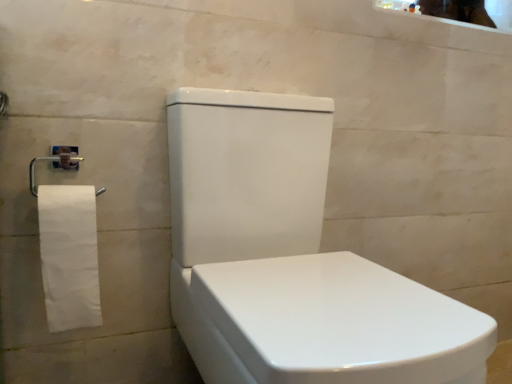
What do you see at coordinates (69, 256) in the screenshot?
I see `white matte toilet paper at left` at bounding box center [69, 256].

Identify the location of glossy ceramic mirror at upper right. (457, 10).

Image resolution: width=512 pixels, height=384 pixels. In order to click on white glossy toilet at center in this screenshot , I will do `click(291, 259)`.

The height and width of the screenshot is (384, 512). I want to click on white matte toilet paper at left, so click(x=69, y=256).

Can you confirm if glossy ceramic mirror at upper right is taller than white glossy toilet at center?

In fact, glossy ceramic mirror at upper right may be shorter than white glossy toilet at center.

Are glossy ceramic mirror at upper right and white glossy toilet at center making contact?

They are not placed beside each other.

From a real-world perspective, which object stands above the other?

From a 3D spatial view, glossy ceramic mirror at upper right is above.

Which is behind, white glossy toilet at center or white matte toilet paper at left?

white matte toilet paper at left.

Who is shorter, white glossy toilet at center or white matte toilet paper at left?

white matte toilet paper at left.

Considering the sizes of white glossy toilet at center and white matte toilet paper at left in the image, is white glossy toilet at center wider or thinner than white matte toilet paper at left?

In the image, white glossy toilet at center appears to be wider than white matte toilet paper at left.

Image resolution: width=512 pixels, height=384 pixels. Find the location of `toilet located below the white matte toilet paper at left (from the image's perspective)`. toilet located below the white matte toilet paper at left (from the image's perspective) is located at coordinates (291, 259).

Does white glossy toilet at center touch glossy ceramic mirror at upper right?

There is a gap between white glossy toilet at center and glossy ceramic mirror at upper right.

From a real-world perspective, is white glossy toilet at center on glossy ceramic mirror at upper right?

No, from a real-world perspective, white glossy toilet at center is not above glossy ceramic mirror at upper right.

Can glossy ceramic mirror at upper right be found inside white glossy toilet at center?

Actually, glossy ceramic mirror at upper right is outside white glossy toilet at center.

Which object is further away from the camera taking this photo, white glossy toilet at center or glossy ceramic mirror at upper right?

glossy ceramic mirror at upper right is more distant.

Does point (50, 306) come closer to viewer compared to point (453, 7)?

Yes, point (50, 306) is closer to viewer.

Consider the image. Which of these two, white matte toilet paper at left or glossy ceramic mirror at upper right, is wider?

With larger width is glossy ceramic mirror at upper right.

I want to click on mirror above the white matte toilet paper at left (from a real-world perspective), so click(457, 10).

Between glossy ceramic mirror at upper right and white matte toilet paper at left, which one appears on the left side from the viewer's perspective?

Positioned to the left is white matte toilet paper at left.

From the image's perspective, which is above, glossy ceramic mirror at upper right or white matte toilet paper at left?

glossy ceramic mirror at upper right.

Considering their positions, is glossy ceramic mirror at upper right located in front of or behind white matte toilet paper at left?

Visually, glossy ceramic mirror at upper right is located behind white matte toilet paper at left.

From their relative heights in the image, would you say white matte toilet paper at left is taller or shorter than white glossy toilet at center?

In the image, white matte toilet paper at left appears to be shorter than white glossy toilet at center.

How many degrees apart are the facing directions of white matte toilet paper at left and white glossy toilet at center?

The angular difference between white matte toilet paper at left and white glossy toilet at center is 0.772 degrees.

In the image, is white matte toilet paper at left positioned in front of or behind white glossy toilet at center?

Clearly, white matte toilet paper at left is behind white glossy toilet at center.

You are a GUI agent. You are given a task and a screenshot of the screen. Output one action in this format:
    pyautogui.click(x=<x>, y=<y>)
    Task: Click on the toilet below the white matte toilet paper at left (from the image's perspective)
    The image size is (512, 384).
    Given the screenshot: What is the action you would take?
    pyautogui.click(x=291, y=259)

Image resolution: width=512 pixels, height=384 pixels. Identify the location of mirror positioned vertically above the white glossy toilet at center (from a real-world perspective). (457, 10).

Where is `toilet located below the white matte toilet paper at left (from the image's perspective)`? toilet located below the white matte toilet paper at left (from the image's perspective) is located at coordinates (291, 259).

Estimate the real-world distances between objects in this image. Which object is further from white matte toilet paper at left, glossy ceramic mirror at upper right or white glossy toilet at center?

Based on the image, glossy ceramic mirror at upper right appears to be further to white matte toilet paper at left.

Which object lies further to the anchor point glossy ceramic mirror at upper right, white matte toilet paper at left or white glossy toilet at center?

white matte toilet paper at left is further to glossy ceramic mirror at upper right.

Estimate the real-world distances between objects in this image. Which object is further from white glossy toilet at center, glossy ceramic mirror at upper right or white matte toilet paper at left?

glossy ceramic mirror at upper right.

Which object lies nearer to the anchor point glossy ceramic mirror at upper right, white glossy toilet at center or white matte toilet paper at left?

white glossy toilet at center is positioned closer to the anchor glossy ceramic mirror at upper right.

Looking at this image, based on their spatial positions, is white matte toilet paper at left or glossy ceramic mirror at upper right further from white glossy toilet at center?

Among the two, glossy ceramic mirror at upper right is located further to white glossy toilet at center.

Considering their positions, is white glossy toilet at center positioned closer to white matte toilet paper at left than glossy ceramic mirror at upper right?

white glossy toilet at center is closer to white matte toilet paper at left.

Image resolution: width=512 pixels, height=384 pixels. Find the location of `toilet between white matte toilet paper at left and glossy ceramic mirror at upper right from left to right`. toilet between white matte toilet paper at left and glossy ceramic mirror at upper right from left to right is located at coordinates (291, 259).